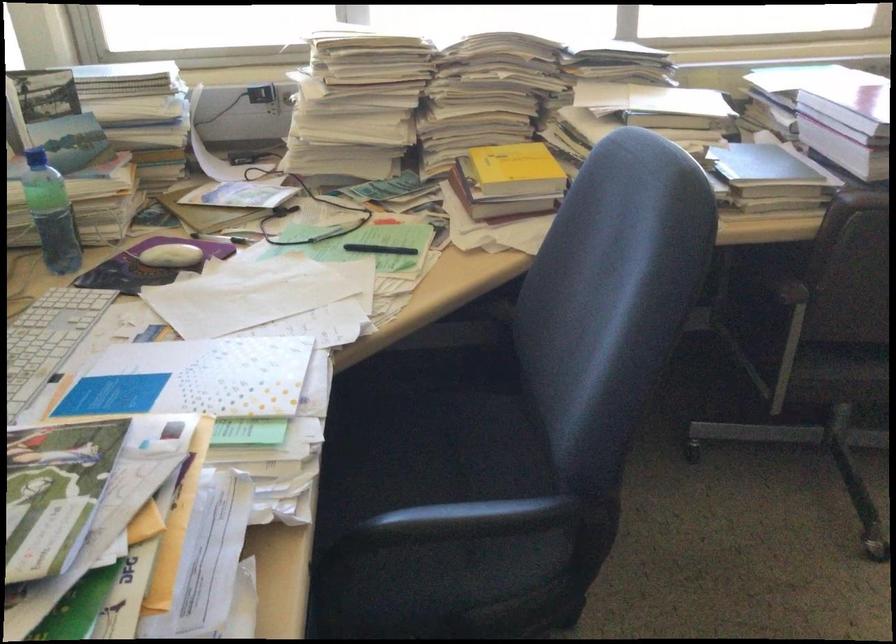
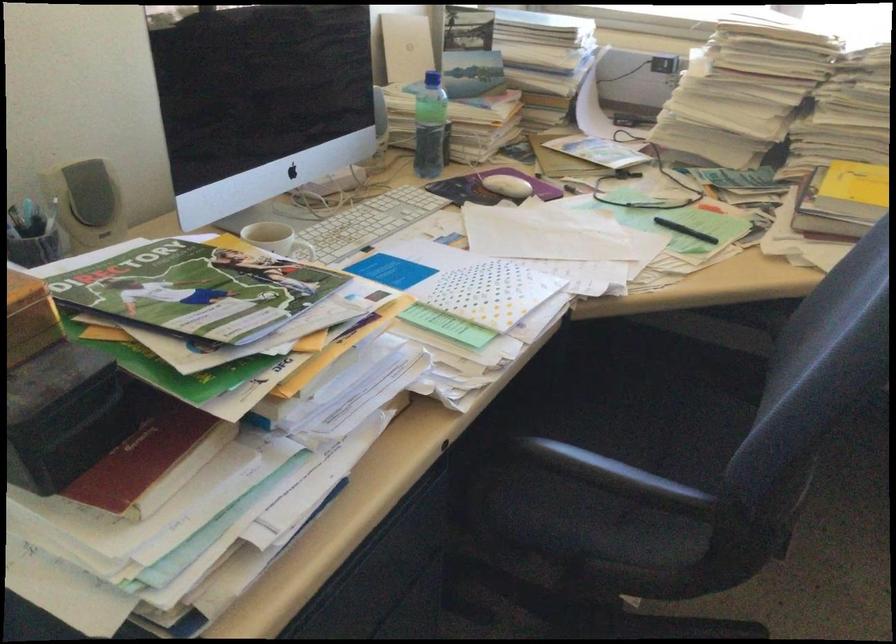
Question: I am providing you with two images of the same scene from different viewpoints. Please identify which objects are invisible in image2.

Choices:
 (A) chair sitting surface
 (B) black chair armrest
 (C) white mug handle
 (D) none of these

Answer: (D)